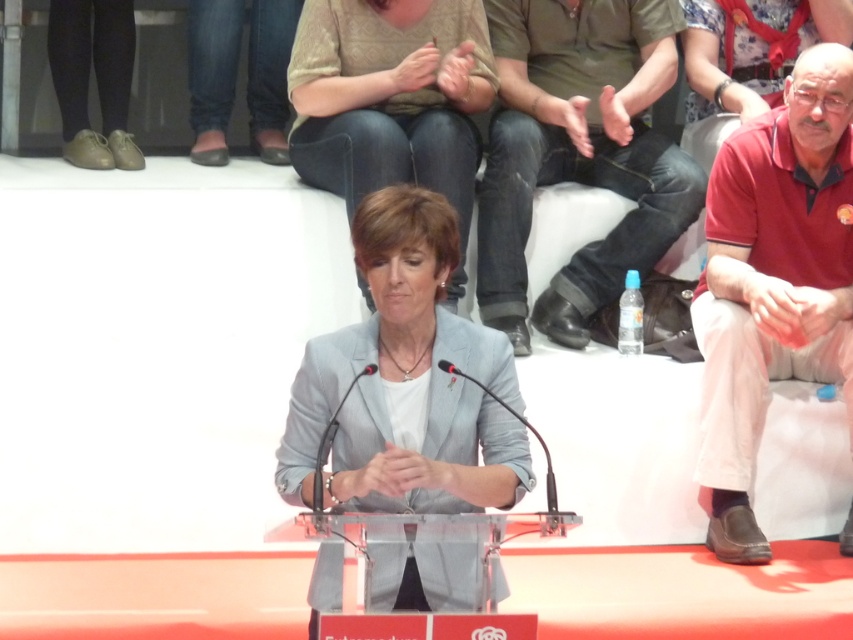
Question: Does red cotton shirt at right have a smaller size compared to jeans at center?

Choices:
 (A) no
 (B) yes

Answer: (B)

Question: Which point appears closest to the camera in this image?

Choices:
 (A) (279, 112)
 (B) (439, 10)
 (C) (355, 333)
 (D) (614, 19)

Answer: (C)

Question: Does jeans at center have a larger size compared to matte beige sweater at upper center?

Choices:
 (A) yes
 (B) no

Answer: (A)

Question: Estimate the real-world distances between objects in this image. Which object is farther from the matte leather shoes at lower left?

Choices:
 (A) matte beige sweater at upper center
 (B) leather flat shoe at upper left
 (C) red cotton shirt at right

Answer: (C)

Question: Does red cotton shirt at right appear on the right side of matte gray blazer at center?

Choices:
 (A) yes
 (B) no

Answer: (B)

Question: Which point is closer to the camera?

Choices:
 (A) (550, 300)
 (B) (262, 138)
 (C) (386, 360)

Answer: (C)